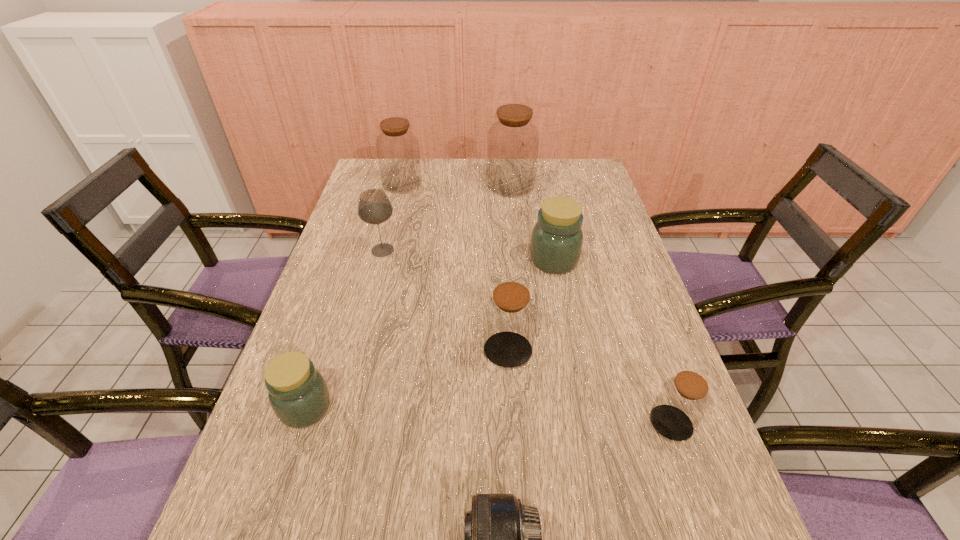
Identify the location of the tallest jar. The image size is (960, 540). (513, 141).

I want to click on the biggest brown jar, so click(513, 141).

Where is `the leftmost brown jar`? The image size is (960, 540). the leftmost brown jar is located at coordinates (397, 147).

Identify the location of the second tallest jar. coord(397,147).

This screenshot has height=540, width=960. I want to click on wineglass, so click(374, 207).

Locate an element on the screen. This screenshot has width=960, height=540. the bigger green jar is located at coordinates (556, 243).

At what (x,y) coordinates should I click in order to perform the action: click on the third farthest jar. Please return your answer as a coordinate pair (x, y). Looking at the image, I should click on (556, 243).

At what (x,y) coordinates should I click in order to perform the action: click on the fourth nearest object. Please return your answer as a coordinate pair (x, y). This screenshot has height=540, width=960. Looking at the image, I should click on (510, 316).

Find the location of `the third nearest jar`. the third nearest jar is located at coordinates (510, 316).

This screenshot has height=540, width=960. I want to click on the smallest brown jar, so click(x=683, y=400).